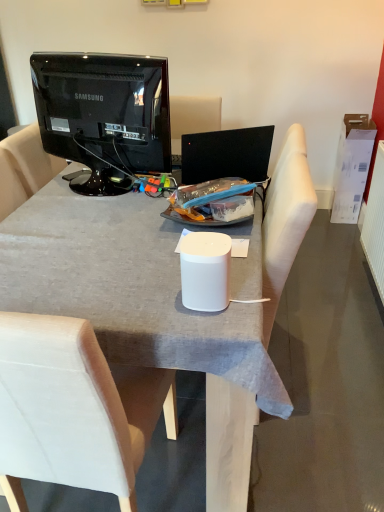
This screenshot has height=512, width=384. Identify the location of free spot in front of white matte smart speaker at center. (207, 327).